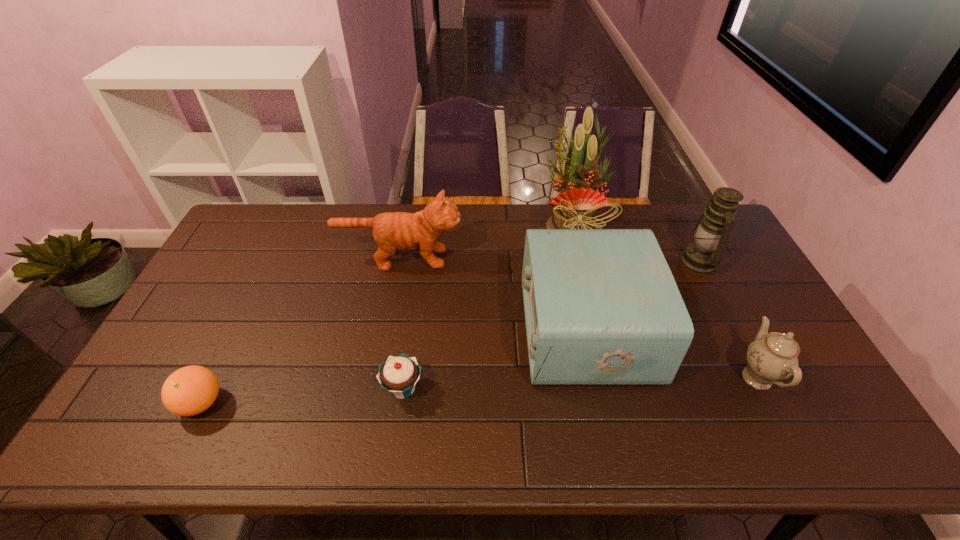
The width and height of the screenshot is (960, 540). What are the coordinates of `cat situated at the far edge` in the screenshot? It's located at (393, 231).

Identify the location of object located in the near edge section of the desktop. The width and height of the screenshot is (960, 540). (188, 391).

Identify the location of object that is at the left edge. (188, 391).

You are a GUI agent. You are given a task and a screenshot of the screen. Output one action in this format:
    pyautogui.click(x=<x>, y=<y>)
    Task: Click on the oil lamp situated at the right edge
    This screenshot has width=960, height=540.
    Given the screenshot: What is the action you would take?
    pyautogui.click(x=710, y=235)

This screenshot has width=960, height=540. I want to click on chinaware that is at the right edge, so click(773, 357).

In order to click on object present at the near left corner in this screenshot , I will do `click(188, 391)`.

You are a GUI agent. You are given a task and a screenshot of the screen. Output one action in this format:
    pyautogui.click(x=<x>, y=<y>)
    Task: Click on the object present at the far right corner
    This screenshot has height=540, width=960.
    Given the screenshot: What is the action you would take?
    pyautogui.click(x=710, y=235)

I want to click on free space at the far edge, so click(x=362, y=210).

Where is `vacant area at the left edge`? This screenshot has height=540, width=960. vacant area at the left edge is located at coordinates (206, 277).

In the image, there is a desktop. Where is `vacant region at the right edge`? This screenshot has height=540, width=960. vacant region at the right edge is located at coordinates (764, 314).